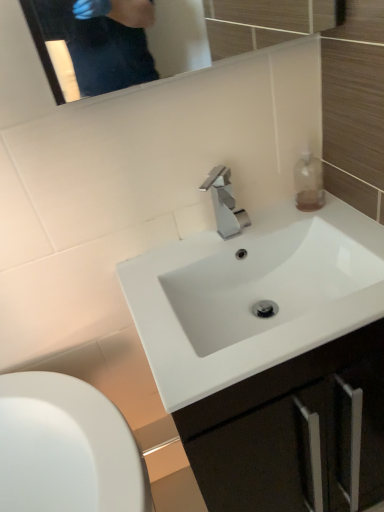
Question: From the image's perspective, is white glossy sink at center, the first sink positioned from the top, above polished metallic faucet at center?

Choices:
 (A) no
 (B) yes

Answer: (A)

Question: Could you tell me if white glossy sink at center, which ranks as the 2th sink in bottom-to-top order, is facing polished metallic faucet at center?

Choices:
 (A) no
 (B) yes

Answer: (A)

Question: Does white glossy sink at center, the first sink positioned from the top, have a lesser height compared to polished metallic faucet at center?

Choices:
 (A) yes
 (B) no

Answer: (A)

Question: From the image's perspective, is white glossy sink at center, the first sink positioned from the top, under polished metallic faucet at center?

Choices:
 (A) yes
 (B) no

Answer: (A)

Question: Is polished metallic faucet at center surrounded by white glossy sink at center, the first sink positioned from the top?

Choices:
 (A) yes
 (B) no

Answer: (B)

Question: From their relative heights in the image, would you say translucent glass bottle at upper right is taller or shorter than white glossy sink at center, which ranks as the 2th sink in bottom-to-top order?

Choices:
 (A) short
 (B) tall

Answer: (A)

Question: Considering their positions, is translucent glass bottle at upper right located in front of or behind white glossy sink at center, the first sink positioned from the top?

Choices:
 (A) front
 (B) behind

Answer: (B)

Question: From a real-world perspective, is translucent glass bottle at upper right physically located above or below white glossy sink at center, the first sink positioned from the top?

Choices:
 (A) below
 (B) above

Answer: (B)

Question: Is translucent glass bottle at upper right inside the boundaries of white glossy sink at center, which ranks as the 2th sink in bottom-to-top order, or outside?

Choices:
 (A) outside
 (B) inside

Answer: (A)

Question: Considering the positions of white glossy sink at center, the first sink when ordered from bottom to top, and translucent glass bottle at upper right in the image, is white glossy sink at center, the first sink when ordered from bottom to top, bigger or smaller than translucent glass bottle at upper right?

Choices:
 (A) big
 (B) small

Answer: (A)

Question: Is white glossy sink at center, the first sink when ordered from bottom to top, inside or outside of translucent glass bottle at upper right?

Choices:
 (A) inside
 (B) outside

Answer: (B)

Question: Relative to translucent glass bottle at upper right, is white glossy sink at center, the first sink when ordered from bottom to top, in front or behind?

Choices:
 (A) front
 (B) behind

Answer: (A)

Question: In terms of width, does white glossy sink at center, the second sink viewed from the top, look wider or thinner when compared to translucent glass bottle at upper right?

Choices:
 (A) thin
 (B) wide

Answer: (B)

Question: Is white glossy sink at center, which ranks as the 2th sink in bottom-to-top order, taller or shorter than white glossy sink at center, the first sink when ordered from bottom to top?

Choices:
 (A) tall
 (B) short

Answer: (B)

Question: Is point (210, 258) positioned closer to the camera than point (190, 238)?

Choices:
 (A) closer
 (B) farther

Answer: (A)